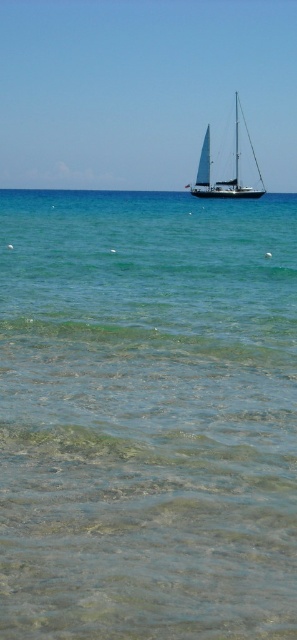
You are standing at the shoreline looking out at the sea. There are two points marked on the water surface, one at coordinate point (65, 269) and another at point (250, 188). Which point is closer to you?

Point (65, 269) is closer to the viewer than point (250, 188).

You are a sailor planning to anchor your boat in the area shown in the image. You see the clear water at center and the white sailboat at center. Which object is located below the other?

The clear water at center is positioned under the white sailboat at center, meaning the water is below the boat.

You are standing on the beach and see the clear water at center and the white sailboat at center. Which object appears smaller in the image?

The clear water at center appears smaller than the white sailboat at center in the image.